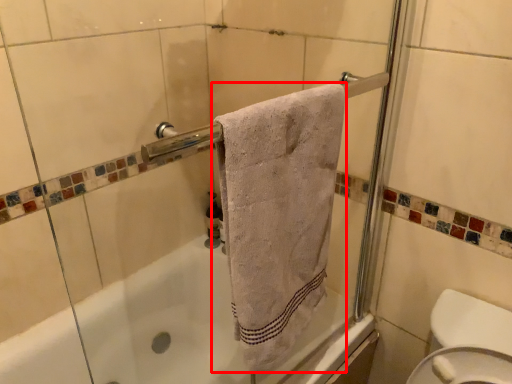
Question: From the image's perspective, where is towel (annotated by the red box) located in relation to toiletry in the image?

Choices:
 (A) below
 (B) above

Answer: (B)